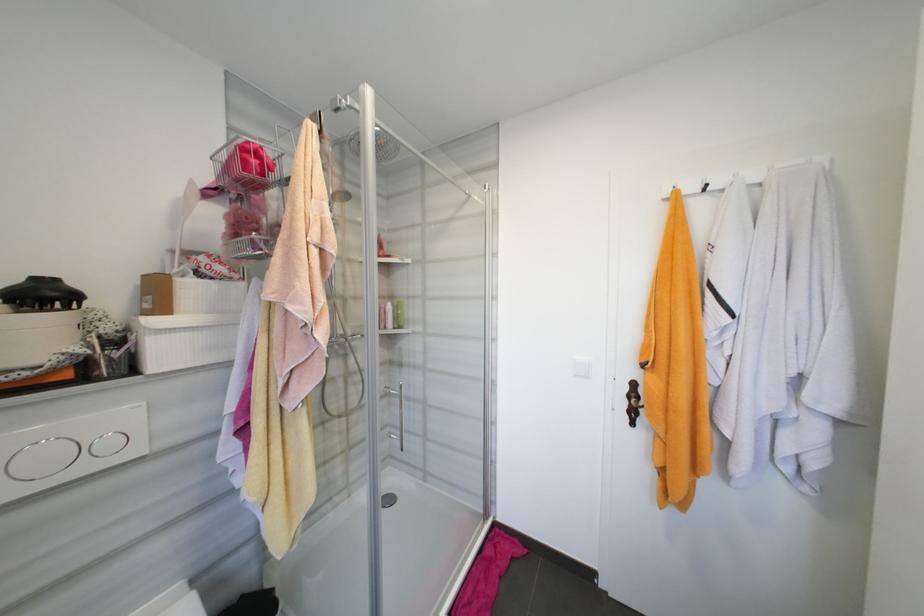
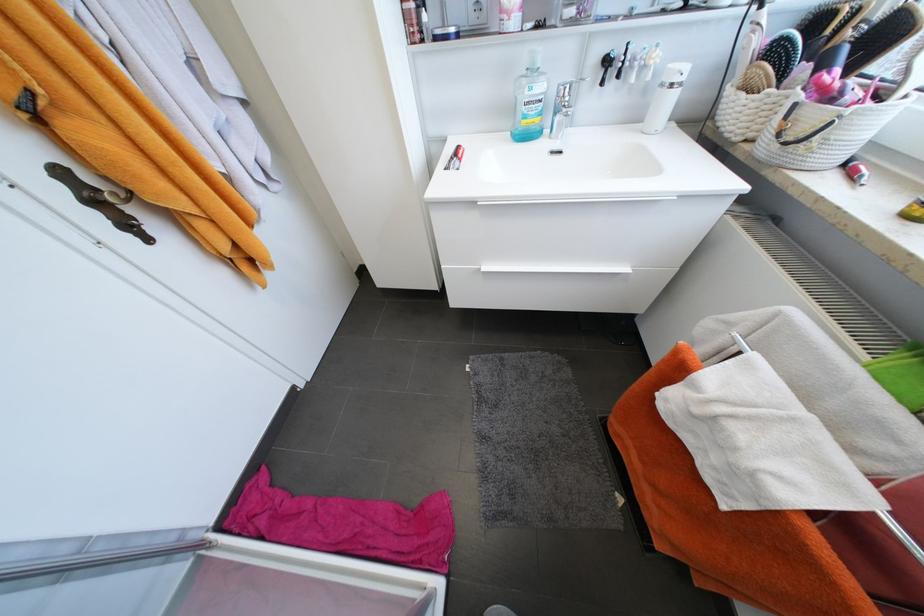
Where in the second image is the point corresponding to [638,415] from the first image?

(132, 225)